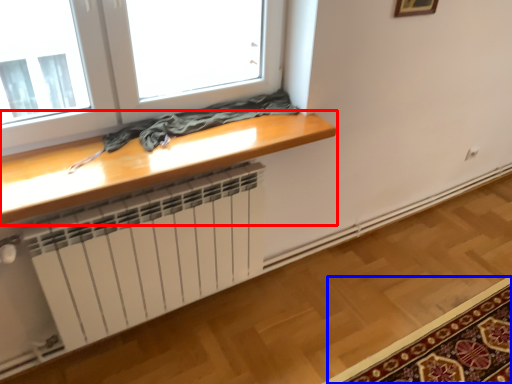
Question: Which object appears farthest to the camera in this image, table (highlighted by a red box) or mat (highlighted by a blue box)?

Choices:
 (A) table
 (B) mat

Answer: (B)